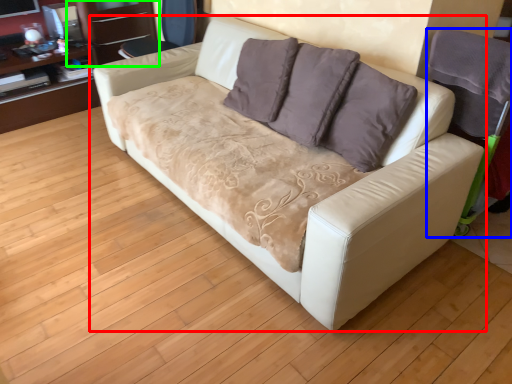
Question: Which is farther away from studio couch (highlighted by a red box)? armchair (highlighted by a blue box) or dresser (highlighted by a green box)?

Choices:
 (A) armchair
 (B) dresser

Answer: (B)